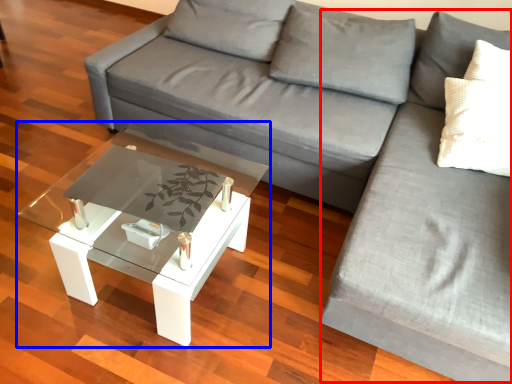
Question: Which object is further to the camera taking this photo, couch (highlighted by a red box) or coffee table (highlighted by a blue box)?

Choices:
 (A) couch
 (B) coffee table

Answer: (B)